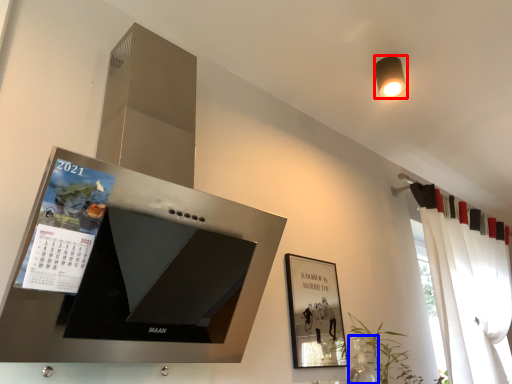
Question: Which point is closer to the camera, light fixture (highlighted by a red box) or glass vase (highlighted by a blue box)?

Choices:
 (A) light fixture
 (B) glass vase

Answer: (B)